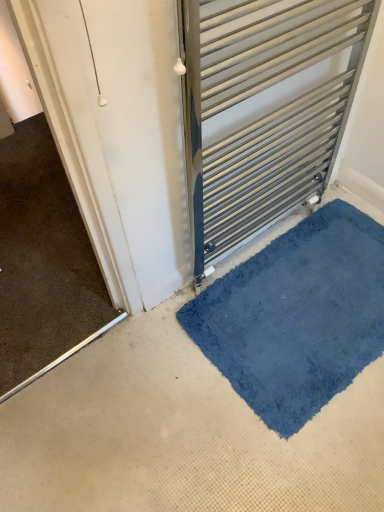
Image resolution: width=384 pixels, height=512 pixels. I want to click on blue plush bath mat at lower right, so click(297, 316).

What do you see at coordinates (297, 316) in the screenshot?
I see `blue plush bath mat at lower right` at bounding box center [297, 316].

What is the approximate width of satin silver towel rack at center?

satin silver towel rack at center is 3.28 inches in width.

Identify the location of satin silver towel rack at center. This screenshot has height=512, width=384. (264, 109).

Describe the element at coordinates (264, 109) in the screenshot. Image resolution: width=384 pixels, height=512 pixels. I see `satin silver towel rack at center` at that location.

I want to click on blue plush bath mat at lower right, so click(297, 316).

From the picture: Can you confirm if blue plush bath mat at lower right is positioned to the right of satin silver towel rack at center?

Yes.

Relative to satin silver towel rack at center, is blue plush bath mat at lower right in front or behind?

blue plush bath mat at lower right is positioned farther from the viewer than satin silver towel rack at center.

Does point (280, 284) come in front of point (286, 141)?

No, it is not.

From the image's perspective, is blue plush bath mat at lower right on top of satin silver towel rack at center?

Actually, blue plush bath mat at lower right appears below satin silver towel rack at center in the image.

From a real-world perspective, which is physically below, blue plush bath mat at lower right or satin silver towel rack at center?

blue plush bath mat at lower right, from a real-world perspective.

Considering the relative sizes of blue plush bath mat at lower right and satin silver towel rack at center in the image provided, is blue plush bath mat at lower right wider than satin silver towel rack at center?

Yes.

Between blue plush bath mat at lower right and satin silver towel rack at center, which one has more height?

satin silver towel rack at center.

Does blue plush bath mat at lower right have a smaller size compared to satin silver towel rack at center?

Yes, blue plush bath mat at lower right is smaller than satin silver towel rack at center.

Is satin silver towel rack at center located within blue plush bath mat at lower right?

Actually, satin silver towel rack at center is outside blue plush bath mat at lower right.

Is blue plush bath mat at lower right in contact with satin silver towel rack at center?

blue plush bath mat at lower right is not next to satin silver towel rack at center, and they're not touching.

Is blue plush bath mat at lower right facing towards satin silver towel rack at center?

No, blue plush bath mat at lower right is not oriented towards satin silver towel rack at center.

Can you tell me how much blue plush bath mat at lower right and satin silver towel rack at center differ in facing direction?

180 degrees.

Image resolution: width=384 pixels, height=512 pixels. In order to click on door on the left of the blue plush bath mat at lower right in this screenshot , I will do `click(264, 109)`.

In the image, is satin silver towel rack at center on the left side or the right side of blue plush bath mat at lower right?

Based on their positions, satin silver towel rack at center is located to the left of blue plush bath mat at lower right.

Between satin silver towel rack at center and blue plush bath mat at lower right, which one is positioned in front?

Positioned in front is satin silver towel rack at center.

Which is behind, point (295, 181) or point (243, 371)?

Positioned behind is point (295, 181).

From the image's perspective, is satin silver towel rack at center above or below blue plush bath mat at lower right?

From the image's perspective, satin silver towel rack at center appears above blue plush bath mat at lower right.

From a real-world perspective, which is physically below, satin silver towel rack at center or blue plush bath mat at lower right?

blue plush bath mat at lower right is physically lower.

Is satin silver towel rack at center thinner than blue plush bath mat at lower right?

Correct, the width of satin silver towel rack at center is less than that of blue plush bath mat at lower right.

Considering the relative sizes of satin silver towel rack at center and blue plush bath mat at lower right in the image provided, is satin silver towel rack at center taller than blue plush bath mat at lower right?

Yes.

Who is bigger, satin silver towel rack at center or blue plush bath mat at lower right?

Bigger between the two is satin silver towel rack at center.

Can we say satin silver towel rack at center lies outside blue plush bath mat at lower right?

Yes, satin silver towel rack at center is outside of blue plush bath mat at lower right.

Is satin silver towel rack at center with blue plush bath mat at lower right?

No, satin silver towel rack at center is not with blue plush bath mat at lower right.

Is satin silver towel rack at center looking in the opposite direction of blue plush bath mat at lower right?

satin silver towel rack at center does not have its back to blue plush bath mat at lower right.

What's the angular difference between satin silver towel rack at center and blue plush bath mat at lower right's facing directions?

The angular difference between satin silver towel rack at center and blue plush bath mat at lower right is 180 degrees.

Identify the location of door on the left of blue plush bath mat at lower right. This screenshot has width=384, height=512. (264, 109).

Locate an element on the screen. This screenshot has height=512, width=384. bath mat below the satin silver towel rack at center (from a real-world perspective) is located at coordinates (297, 316).

The image size is (384, 512). In order to click on door located above the blue plush bath mat at lower right (from a real-world perspective) in this screenshot , I will do `click(264, 109)`.